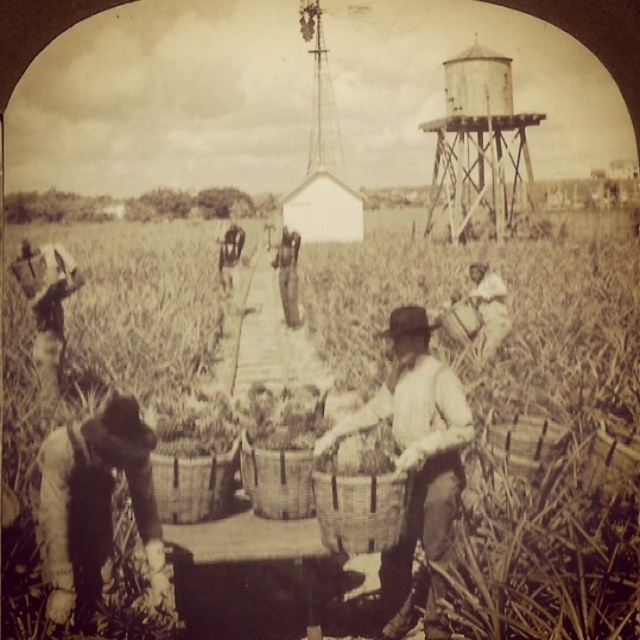
You are a farmer who needs to move a heavy tool from the dark brown fabric at lower left to the wooden water tower at upper right. The tool requires a clear path that is at least 100 feet long. Can you safely move the tool along the path between them?

The dark brown fabric at lower left and wooden water tower at upper right are 107.70 feet apart from each other. Since the required path length is at least 100 feet, the distance of 107.70 feet is sufficient, so you can safely move the tool along the path between them.

Based on the scene described, which object, the dark brown fabric at lower left or the wooden water tower at upper right, is positioned higher in the image?

The dark brown fabric at lower left is much taller than the wooden water tower at upper right, so it is positioned higher in the image.

In the scene shown: You are a farmer in this historical scene and need to store your harvest. Which object, the woven baskets at center or the dark brown fabric at lower left, is taller and better suited for stacking corn?

The woven baskets at center has a greater height compared to the dark brown fabric at lower left, so it is better suited for stacking corn.